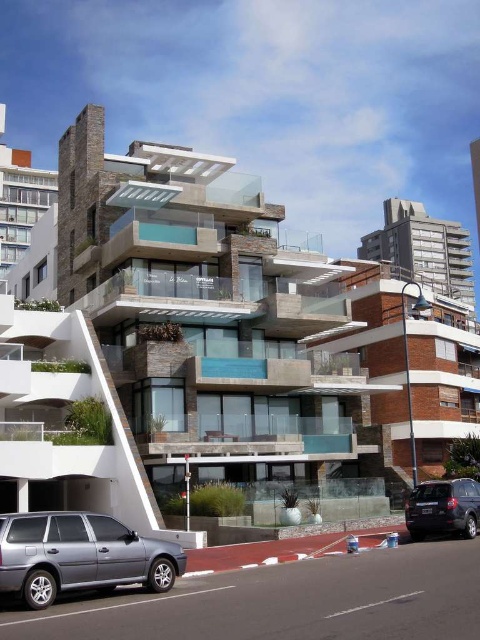
Between silver metallic suv at lower left and dark gray matte suv at lower right, which one appears on the left side from the viewer's perspective?

From the viewer's perspective, silver metallic suv at lower left appears more on the left side.

Between silver metallic suv at lower left and dark gray matte suv at lower right, which one has more height?

With more height is silver metallic suv at lower left.

Does point (67, 564) come behind point (445, 522)?

No, it is not.

Locate an element on the screen. Image resolution: width=480 pixels, height=640 pixels. silver metallic suv at lower left is located at coordinates [80, 556].